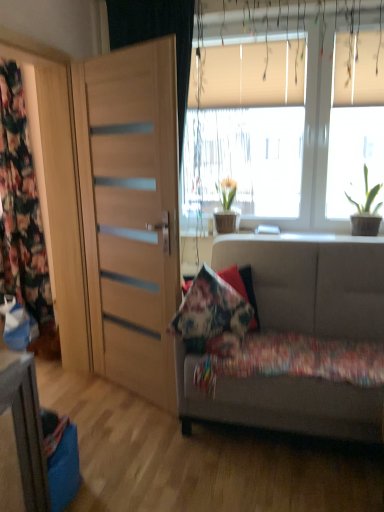
Question: Which direction should I rotate to look at green matte plant at center, which is counted as the 2th houseplant, starting from the front?

Choices:
 (A) left
 (B) right

Answer: (B)

Question: From the image's perspective, is light wood door at left over textured beige couch at lower right?

Choices:
 (A) no
 (B) yes

Answer: (B)

Question: Does light wood door at left have a smaller size compared to textured beige couch at lower right?

Choices:
 (A) no
 (B) yes

Answer: (B)

Question: From the image's perspective, is light wood door at left below textured beige couch at lower right?

Choices:
 (A) no
 (B) yes

Answer: (A)

Question: Is light wood door at left directly adjacent to textured beige couch at lower right?

Choices:
 (A) yes
 (B) no

Answer: (B)

Question: Is light wood door at left outside textured beige couch at lower right?

Choices:
 (A) no
 (B) yes

Answer: (B)

Question: Is light wood door at left oriented away from textured beige couch at lower right?

Choices:
 (A) no
 (B) yes

Answer: (A)

Question: From the image's perspective, would you say green matte plant at upper right, positioned as the 1th houseplant in right-to-left order, is shown under textured beige couch at lower right?

Choices:
 (A) yes
 (B) no

Answer: (B)

Question: From the image's perspective, is green matte plant at upper right, positioned as the 1th houseplant in right-to-left order, above textured beige couch at lower right?

Choices:
 (A) yes
 (B) no

Answer: (A)

Question: Is green matte plant at upper right, positioned as the 1th houseplant in right-to-left order, closer to camera compared to textured beige couch at lower right?

Choices:
 (A) no
 (B) yes

Answer: (A)

Question: From a real-world perspective, is green matte plant at upper right, which is counted as the 2th houseplant, starting from the left, beneath textured beige couch at lower right?

Choices:
 (A) yes
 (B) no

Answer: (B)

Question: Does green matte plant at upper right, the 2th houseplant positioned from the back, have a greater width compared to textured beige couch at lower right?

Choices:
 (A) yes
 (B) no

Answer: (B)

Question: Does green matte plant at upper right, the 2th houseplant positioned from the back, come behind textured beige couch at lower right?

Choices:
 (A) yes
 (B) no

Answer: (A)

Question: Is floral fabric curtain at left not near textured beige couch at lower right?

Choices:
 (A) no
 (B) yes

Answer: (B)